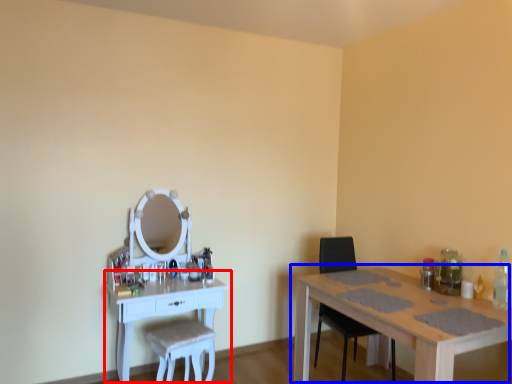
Question: Which object is further to the camera taking this photo, table (highlighted by a red box) or table (highlighted by a blue box)?

Choices:
 (A) table
 (B) table

Answer: (A)